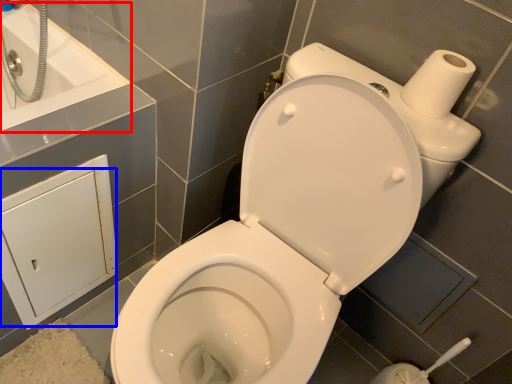
Question: Which point is further to the camera, bath (highlighted by a red box) or screen door (highlighted by a blue box)?

Choices:
 (A) bath
 (B) screen door

Answer: (A)